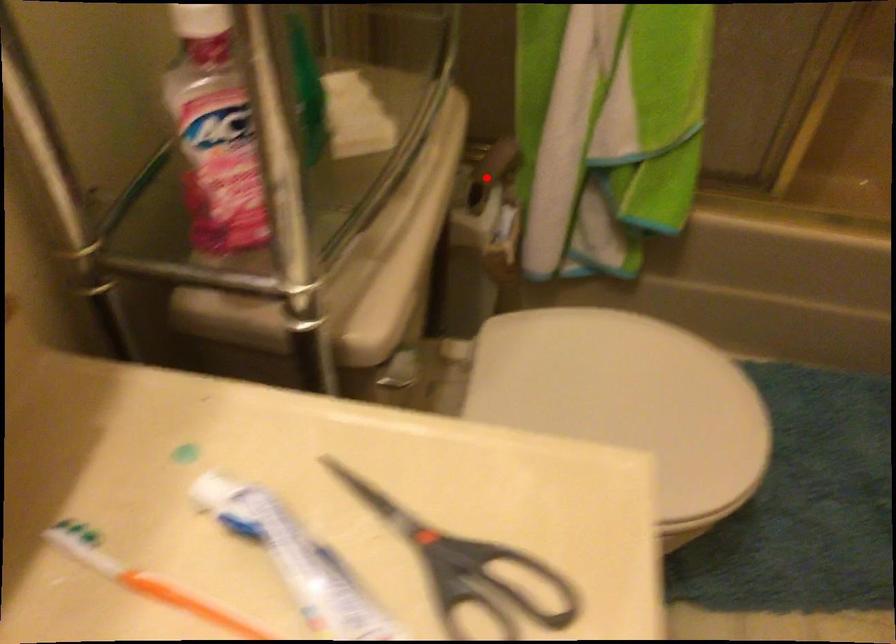
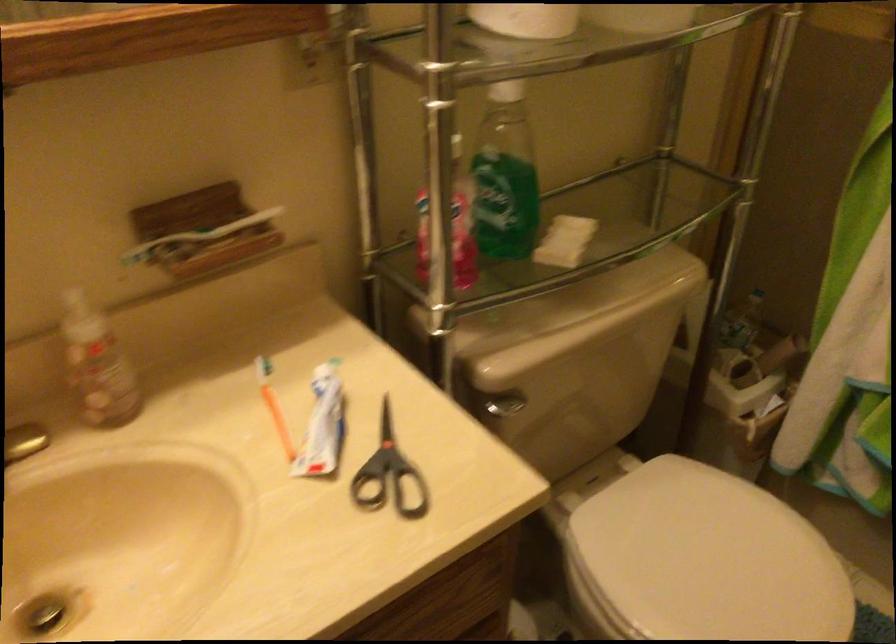
Question: I am providing you with two images of the same scene from different viewpoints. In image1, a red point is highlighted. Considering the same 3D point in image2, which of the following is correct?

Choices:
 (A) It is closer
 (B) It is farther

Answer: (B)